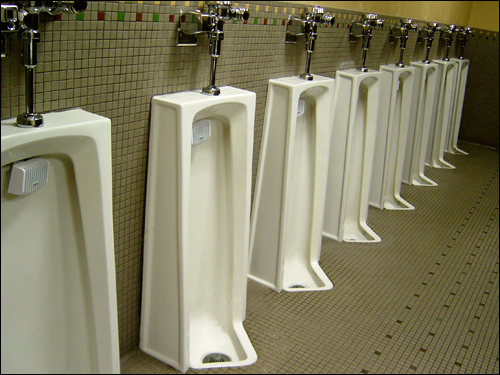
Identify the location of urinals. The width and height of the screenshot is (500, 375). (93, 183), (163, 180), (279, 158), (343, 128), (388, 112), (420, 104), (443, 94), (459, 87).